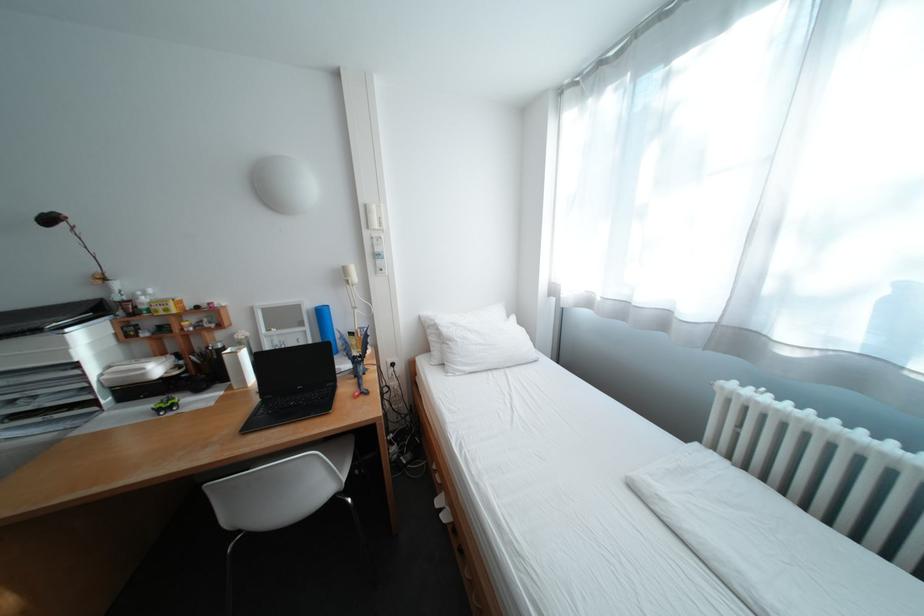
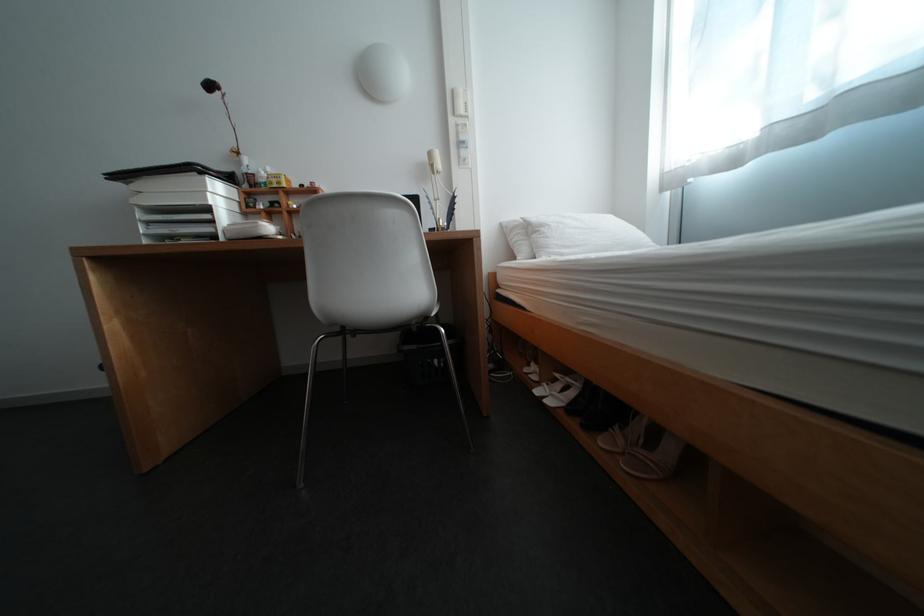
Which direction would the cameraman need to move to produce the second image?

The cameraman walked toward left, forward.